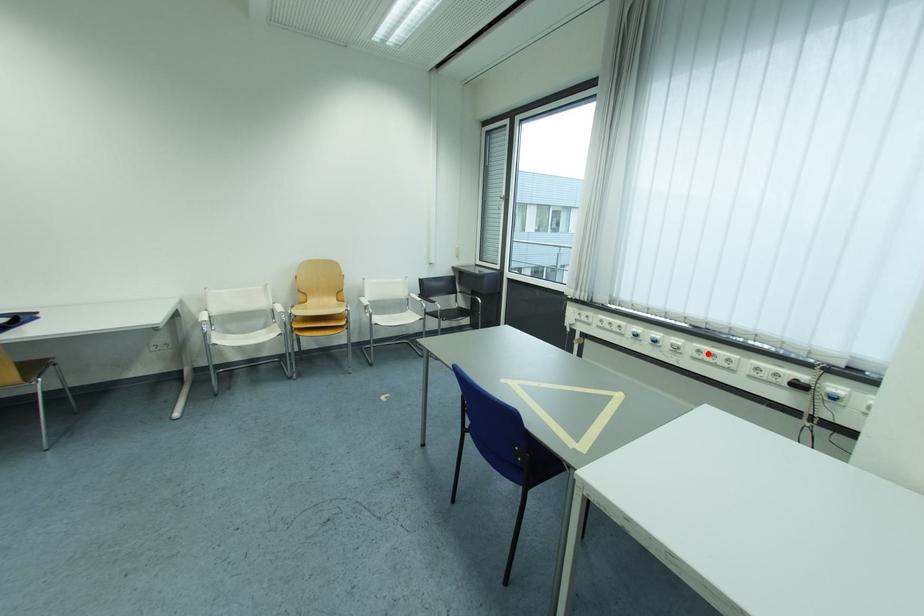
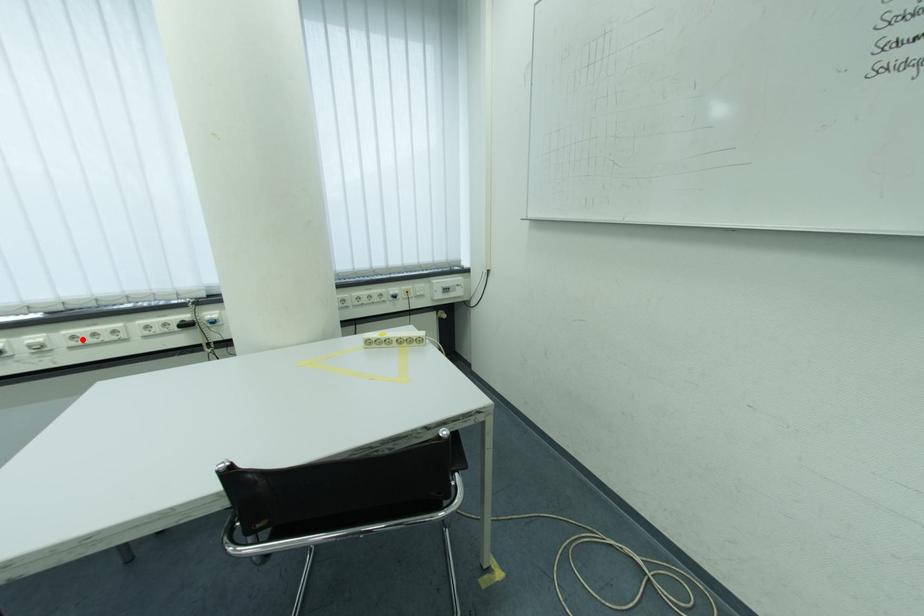
I am providing you with two images of the same scene from different viewpoints. A red point is marked on the first image and another point is marked on the second image. Does the point marked in image1 correspond to the same location as the one in image2?

Yes